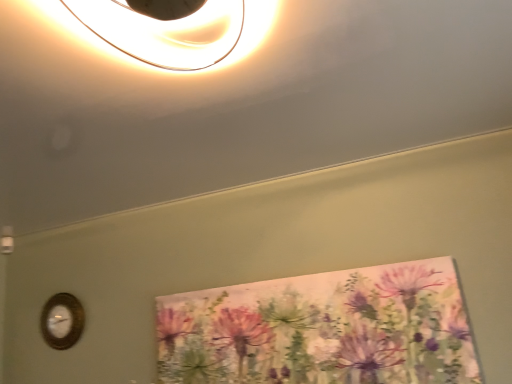
Describe the element at coordinates (322, 329) in the screenshot. The image size is (512, 384). I see `watercolor floral painting at center` at that location.

Where is `watercolor floral painting at center`? The image size is (512, 384). watercolor floral painting at center is located at coordinates (322, 329).

At what (x,y) coordinates should I click in order to perform the action: click on wooden wall clock at lower left. Please return your answer as a coordinate pair (x, y). Looking at the image, I should click on (62, 321).

Describe the element at coordinates (62, 321) in the screenshot. I see `wooden wall clock at lower left` at that location.

You are a GUI agent. You are given a task and a screenshot of the screen. Output one action in this format:
    pyautogui.click(x=<x>, y=<y>)
    Task: Click on the watercolor floral painting at center
    
    Given the screenshot: What is the action you would take?
    pyautogui.click(x=322, y=329)

Considering the positions of objects wooden wall clock at lower left and watercolor floral painting at center in the image provided, who is more to the left, wooden wall clock at lower left or watercolor floral painting at center?

Positioned to the left is wooden wall clock at lower left.

Which object is more forward, wooden wall clock at lower left or watercolor floral painting at center?

watercolor floral painting at center.

Which point is more forward, (74, 335) or (434, 274)?

Point (434, 274)

From the image's perspective, which object appears higher, wooden wall clock at lower left or watercolor floral painting at center?

From the image's view, watercolor floral painting at center is above.

From a real-world perspective, who is located lower, wooden wall clock at lower left or watercolor floral painting at center?

watercolor floral painting at center, from a real-world perspective.

In terms of width, does wooden wall clock at lower left look wider or thinner when compared to watercolor floral painting at center?

In the image, wooden wall clock at lower left appears to be more narrow than watercolor floral painting at center.

Considering the sizes of objects wooden wall clock at lower left and watercolor floral painting at center in the image provided, who is taller, wooden wall clock at lower left or watercolor floral painting at center?

Standing taller between the two is watercolor floral painting at center.

Considering the relative sizes of wooden wall clock at lower left and watercolor floral painting at center in the image provided, is wooden wall clock at lower left smaller than watercolor floral painting at center?

Yes, wooden wall clock at lower left is smaller than watercolor floral painting at center.

In the scene shown: Is wooden wall clock at lower left inside the boundaries of watercolor floral painting at center, or outside?

wooden wall clock at lower left is not inside watercolor floral painting at center, it's outside.

Would you consider wooden wall clock at lower left to be distant from watercolor floral painting at center?

Yes, wooden wall clock at lower left and watercolor floral painting at center are located far from each other.

Is wooden wall clock at lower left facing towards watercolor floral painting at center?

No, wooden wall clock at lower left is not turned towards watercolor floral painting at center.

Can you tell me how much wooden wall clock at lower left and watercolor floral painting at center differ in facing direction?

The angle between the facing direction of wooden wall clock at lower left and the facing direction of watercolor floral painting at center is 0.775 degrees.

You are a GUI agent. You are given a task and a screenshot of the screen. Output one action in this format:
    pyautogui.click(x=<x>, y=<y>)
    Task: Click on the flower located in front of the wooden wall clock at lower left
    The width and height of the screenshot is (512, 384).
    Given the screenshot: What is the action you would take?
    pyautogui.click(x=322, y=329)

Is watercolor floral painting at center at the right side of wooden wall clock at lower left?

Yes, watercolor floral painting at center is to the right of wooden wall clock at lower left.

Considering the positions of objects watercolor floral painting at center and wooden wall clock at lower left in the image provided, who is in front, watercolor floral painting at center or wooden wall clock at lower left?

watercolor floral painting at center is in front.

Does point (277, 299) come closer to viewer compared to point (41, 331)?

Yes, point (277, 299) is in front of point (41, 331).

From the image's perspective, which one is positioned lower, watercolor floral painting at center or wooden wall clock at lower left?

wooden wall clock at lower left appears lower in the image.

From a real-world perspective, is watercolor floral painting at center beneath wooden wall clock at lower left?

Yes, from a real-world perspective, watercolor floral painting at center is under wooden wall clock at lower left.

Which object is wider, watercolor floral painting at center or wooden wall clock at lower left?

With larger width is watercolor floral painting at center.

Considering the sizes of objects watercolor floral painting at center and wooden wall clock at lower left in the image provided, who is taller, watercolor floral painting at center or wooden wall clock at lower left?

With more height is watercolor floral painting at center.

Who is smaller, watercolor floral painting at center or wooden wall clock at lower left?

With smaller size is wooden wall clock at lower left.

Which is correct: watercolor floral painting at center is inside wooden wall clock at lower left, or outside of it?

watercolor floral painting at center is outside wooden wall clock at lower left.

Can you see watercolor floral painting at center touching wooden wall clock at lower left?

watercolor floral painting at center and wooden wall clock at lower left are clearly separated.

Is watercolor floral painting at center aimed at wooden wall clock at lower left?

No, watercolor floral painting at center is not facing towards wooden wall clock at lower left.

Measure the distance between watercolor floral painting at center and wooden wall clock at lower left.

watercolor floral painting at center and wooden wall clock at lower left are 3.34 feet apart.

The width and height of the screenshot is (512, 384). I want to click on flower on the right of wooden wall clock at lower left, so click(x=322, y=329).

Identify the location of wall clock below the watercolor floral painting at center (from the image's perspective). The width and height of the screenshot is (512, 384). (62, 321).

Identify the location of flower located underneath the wooden wall clock at lower left (from a real-world perspective). This screenshot has height=384, width=512. (322, 329).